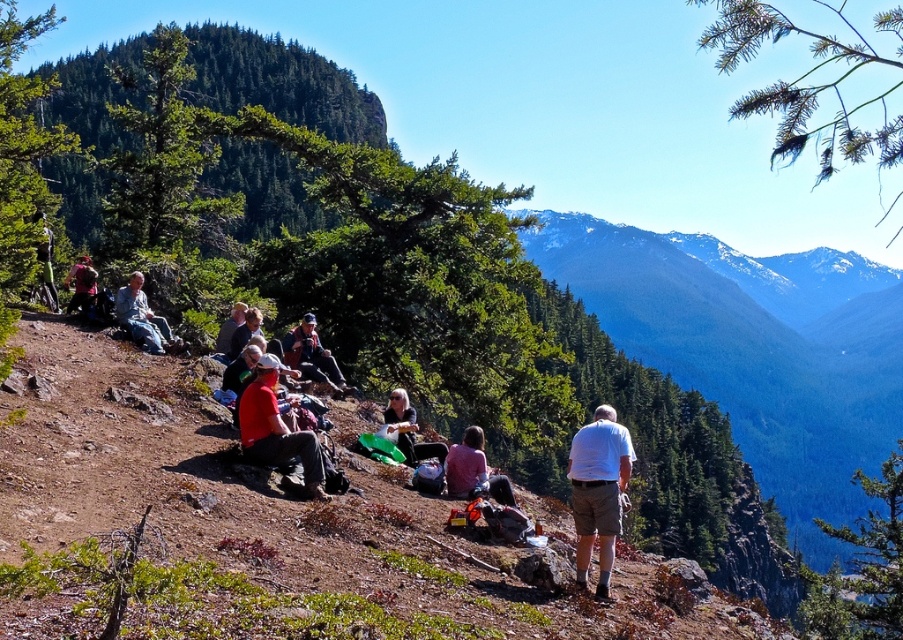
You are a hiker who needs to pass between the pink fabric jacket at center and the light brown leather jacket at center. Your backpack is 1.5 meters wide. Can you fit through the space between them?

The distance between the pink fabric jacket at center and the light brown leather jacket at center is 7.31 meters, which is wider than your backpack. Therefore, you can easily pass through the space between them.